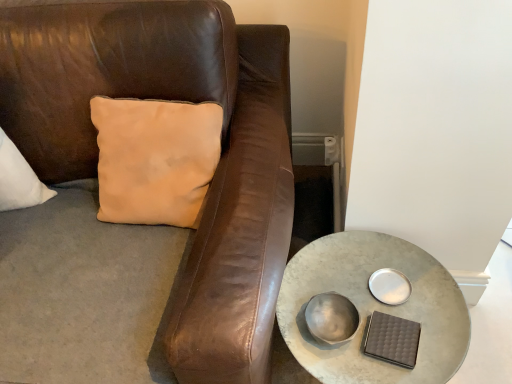
Where is `vacant area that is situated to the right of metallic silver bowl at lower center`? The width and height of the screenshot is (512, 384). vacant area that is situated to the right of metallic silver bowl at lower center is located at coordinates (402, 310).